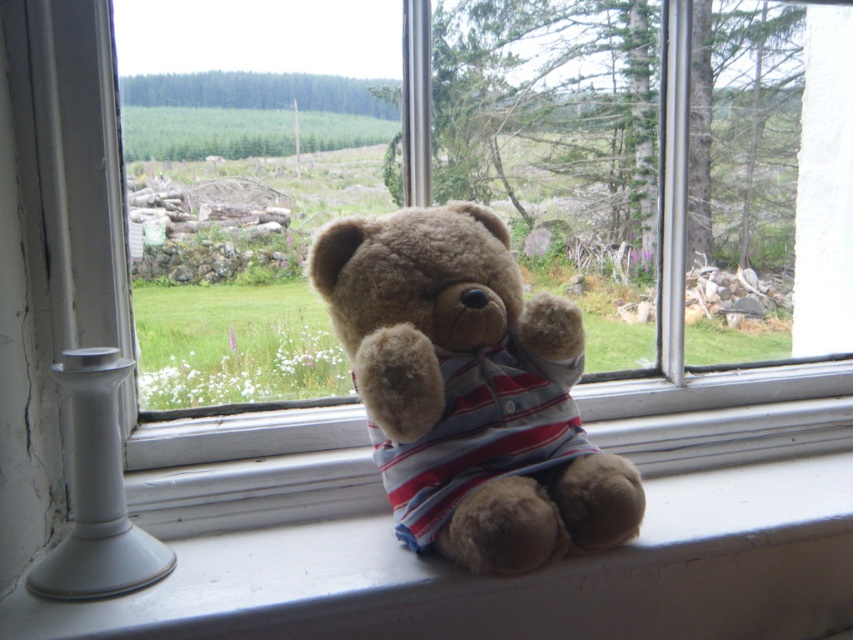
Between white smooth window sill at lower center and fuzzy brown bear at center, which one appears on the right side from the viewer's perspective?

Positioned to the right is white smooth window sill at lower center.

Between white smooth window sill at lower center and fuzzy brown bear at center, which one has more height?

With more height is fuzzy brown bear at center.

This screenshot has width=853, height=640. In order to click on white smooth window sill at lower center in this screenshot , I will do `click(511, 577)`.

The height and width of the screenshot is (640, 853). What are the coordinates of `white smooth window sill at lower center` in the screenshot? It's located at (511, 577).